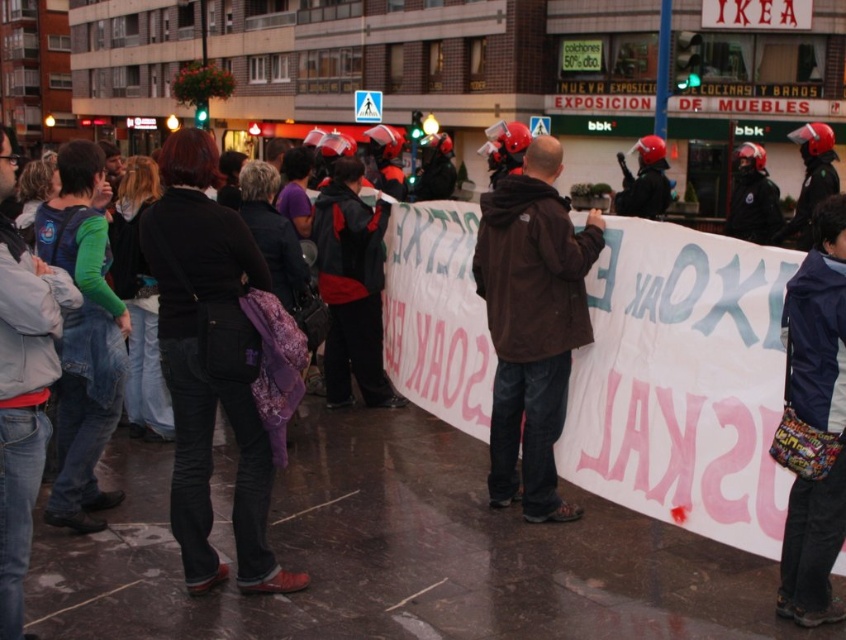
Question: Which object appears farthest from the camera in this image?

Choices:
 (A) navy blue fabric jacket at lower right
 (B) brown fabric jacket at center

Answer: (B)

Question: Is brown fabric jacket at center positioned behind navy blue fabric jacket at lower right?

Choices:
 (A) yes
 (B) no

Answer: (A)

Question: Is brown fabric jacket at center further to camera compared to navy blue fabric jacket at lower right?

Choices:
 (A) yes
 (B) no

Answer: (A)

Question: Does brown fabric jacket at center have a smaller size compared to navy blue fabric jacket at lower right?

Choices:
 (A) yes
 (B) no

Answer: (B)